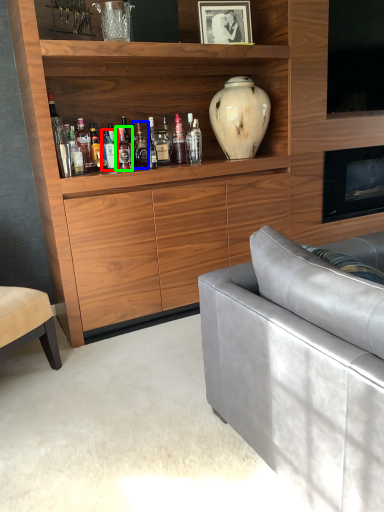
Question: Which object is the closest to the bottle (highlighted by a red box)? Choose among these: bottle (highlighted by a blue box) or bottle (highlighted by a green box).

Choices:
 (A) bottle
 (B) bottle

Answer: (B)